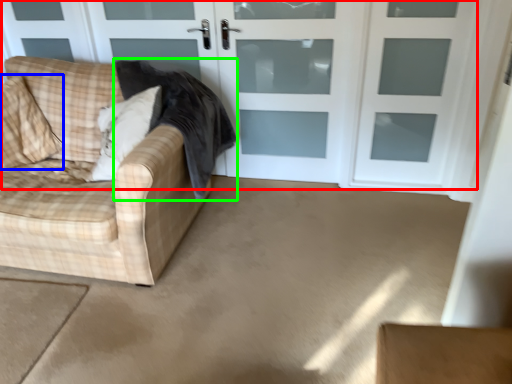
Question: Considering the real-world distances, which object is farthest from door (highlighted by a red box)? pillow (highlighted by a blue box) or blanket (highlighted by a green box)?

Choices:
 (A) pillow
 (B) blanket

Answer: (A)